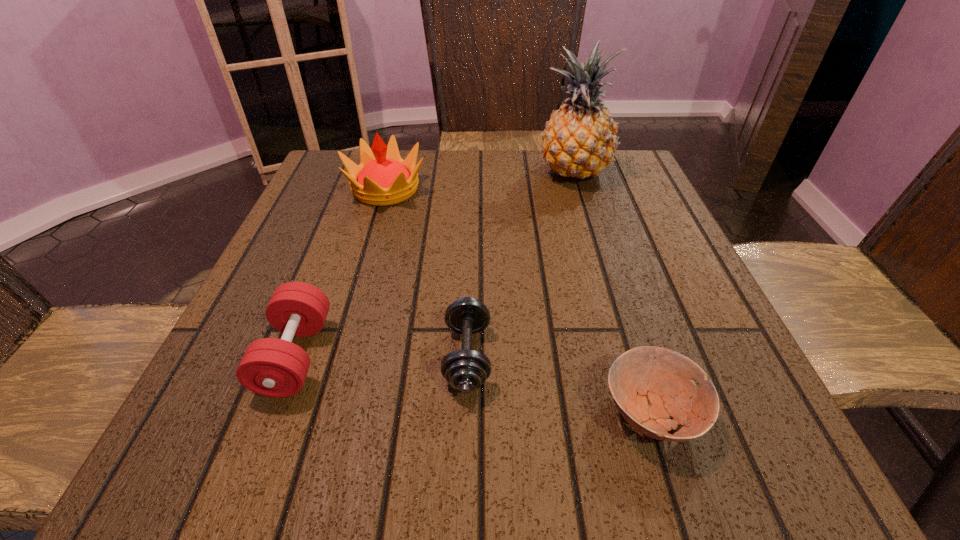
In order to click on the tallest object in this screenshot , I will do `click(579, 140)`.

What are the coordinates of `the fourth shortest object` in the screenshot? It's located at (383, 178).

You are a GUI agent. You are given a task and a screenshot of the screen. Output one action in this format:
    pyautogui.click(x=<x>, y=<y>)
    Task: Click on the left dumbbell
    The image size is (960, 540).
    Given the screenshot: What is the action you would take?
    pyautogui.click(x=271, y=367)

Locate an element on the screen. This screenshot has width=960, height=540. the taller dumbbell is located at coordinates (271, 367).

The width and height of the screenshot is (960, 540). I want to click on the third object from right to left, so click(x=465, y=370).

What are the coordinates of `the right dumbbell` in the screenshot? It's located at (465, 370).

This screenshot has width=960, height=540. Find the location of `bowl`. bowl is located at coordinates (649, 385).

Locate an element on the screen. The width and height of the screenshot is (960, 540). vacant space located 0.130m on the front of the tallest object is located at coordinates (591, 227).

At what (x,y) coordinates should I click in order to perform the action: click on vacant space situated on the front of the crown. Please return your answer as a coordinate pair (x, y). This screenshot has height=540, width=960. Looking at the image, I should click on (372, 235).

Find the location of a particular element. This screenshot has width=960, height=540. vacant space located 0.070m on the back of the third shortest object is located at coordinates (322, 287).